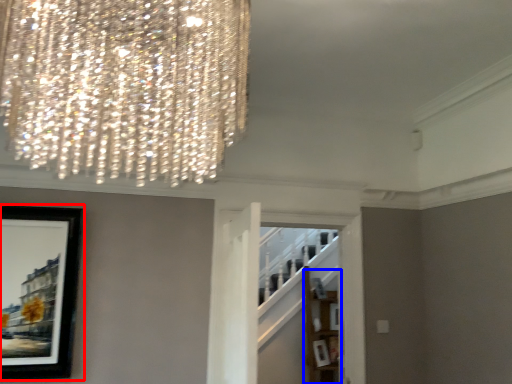
Question: Which point is closer to the camera, picture frame (highlighted by a red box) or shelf (highlighted by a blue box)?

Choices:
 (A) picture frame
 (B) shelf

Answer: (A)